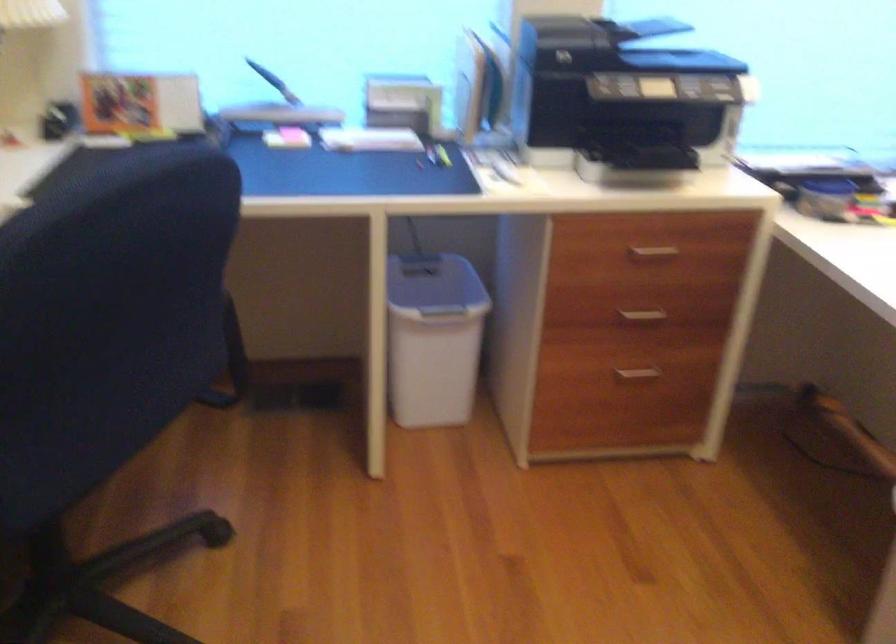
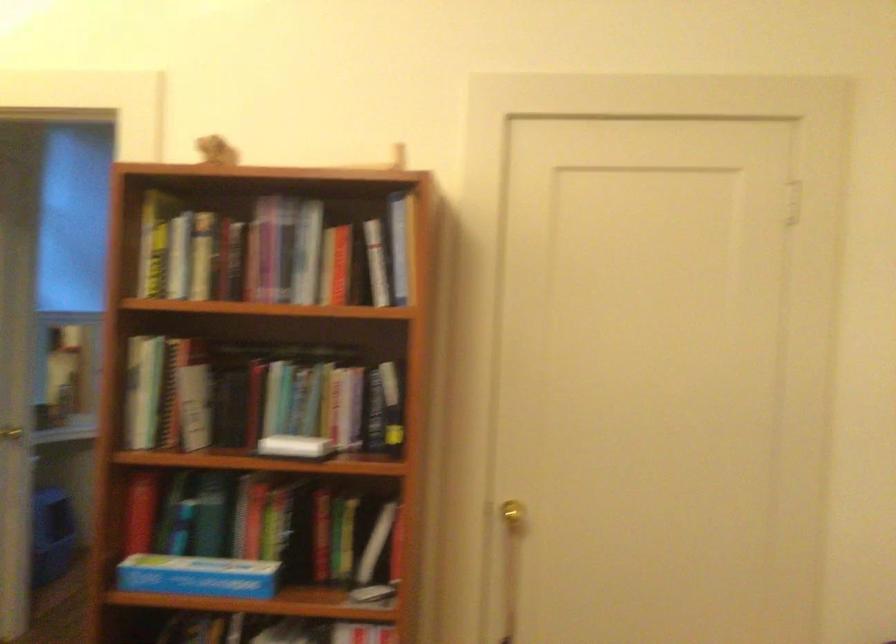
Question: The first image is from the beginning of the video and the second image is from the end. How did the camera likely rotate when shooting the video?

Choices:
 (A) Left
 (B) Right
 (C) Up
 (D) Down

Answer: (B)